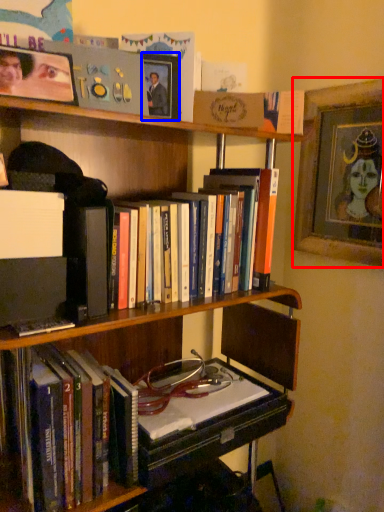
Question: Which object appears farthest to the camera in this image, picture frame (highlighted by a red box) or picture frame (highlighted by a blue box)?

Choices:
 (A) picture frame
 (B) picture frame

Answer: (A)